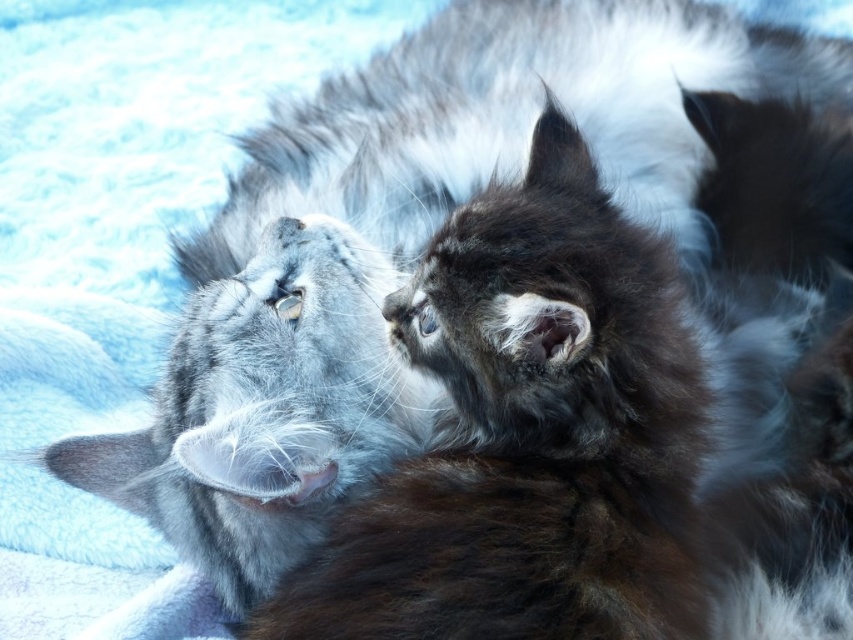
Question: Observing the image, what is the correct spatial positioning of soft fur cat at upper left in reference to fluffy brown fur at right?

Choices:
 (A) right
 (B) left

Answer: (B)

Question: Does soft fur cat at upper left have a larger size compared to fluffy brown fur at right?

Choices:
 (A) yes
 (B) no

Answer: (B)

Question: Is fluffy gray cat at center further to the viewer compared to soft fur cat at upper left?

Choices:
 (A) yes
 (B) no

Answer: (B)

Question: Which of the following is the farthest from the observer?

Choices:
 (A) fluffy gray cat at center
 (B) soft fur cat at upper left

Answer: (B)

Question: Which object appears farthest from the camera in this image?

Choices:
 (A) fluffy gray cat at center
 (B) soft fur cat at upper left

Answer: (B)

Question: Among these points, which one is nearest to the camera?

Choices:
 (A) [613, 209]
 (B) [416, 410]
 (C) [763, 145]

Answer: (A)